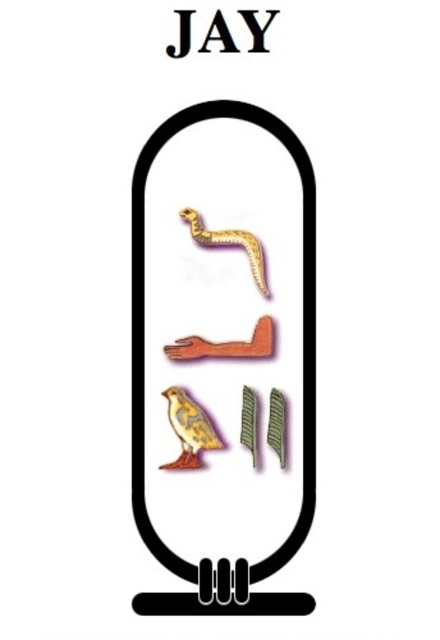
Question: Does gold metallic snake at center appear on the right side of black matte letter at upper center?

Choices:
 (A) yes
 (B) no

Answer: (A)

Question: Which point is farther from the camera taking this photo?

Choices:
 (A) (256, 44)
 (B) (189, 13)
 (C) (191, 211)
 (D) (308, 444)

Answer: (C)

Question: Which point is farther to the camera?

Choices:
 (A) (183, 36)
 (B) (263, 42)
 (C) (168, 392)
 (D) (312, 221)

Answer: (D)

Question: Which object is the closest to the black matte letter at upper center?

Choices:
 (A) black plastic y at upper center
 (B) black paper jay at upper center
 (C) golden textured bird at center

Answer: (B)

Question: Can you confirm if black plastic y at upper center is smaller than black paper jay at upper center?

Choices:
 (A) no
 (B) yes

Answer: (A)

Question: Can you confirm if black matte letter at upper center is bigger than black paper jay at upper center?

Choices:
 (A) yes
 (B) no

Answer: (B)